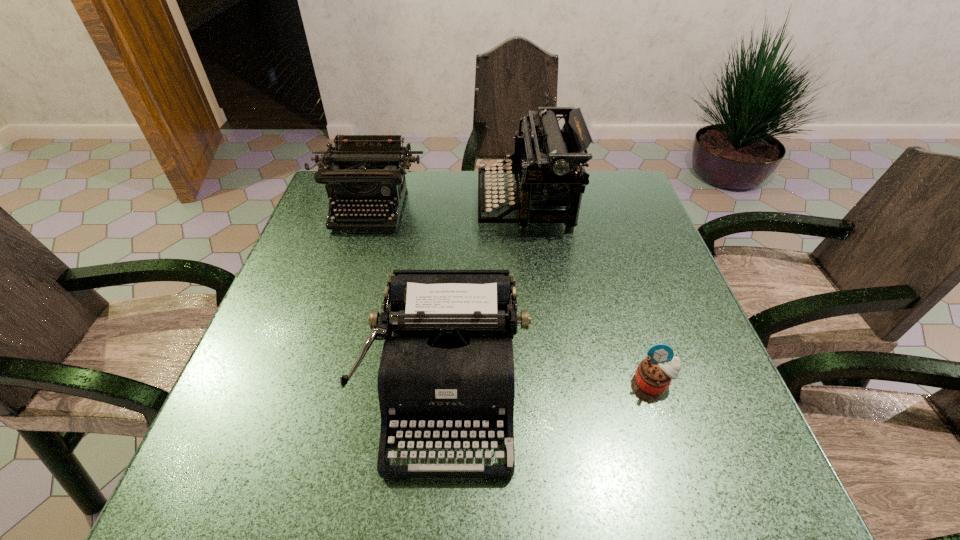
Locate an element on the screen. The width and height of the screenshot is (960, 540). the tallest object is located at coordinates (550, 162).

Find the location of a particular element. the nearest typewriter is located at coordinates (449, 366).

Locate an element on the screen. the shortest object is located at coordinates (654, 374).

I want to click on muffin, so click(654, 374).

Identify the location of blank area located on the typing side of the tallest typewriter. The height and width of the screenshot is (540, 960). (425, 204).

I want to click on blank area located on the typing side of the tallest typewriter, so click(x=380, y=204).

Identify the location of free space located on the typing side of the tallest typewriter. This screenshot has width=960, height=540. (387, 204).

Where is `free space located on the front-facing side of the rightmost object`? free space located on the front-facing side of the rightmost object is located at coordinates (670, 434).

Find the location of a particular element. This screenshot has height=540, width=960. object at the near edge is located at coordinates (449, 366).

The height and width of the screenshot is (540, 960). I want to click on object at the left edge, so click(x=360, y=170).